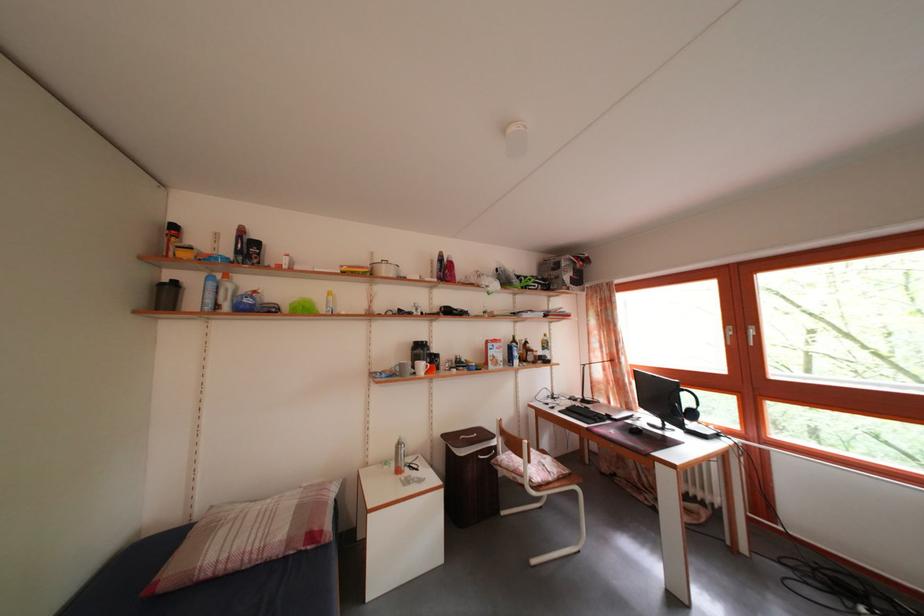
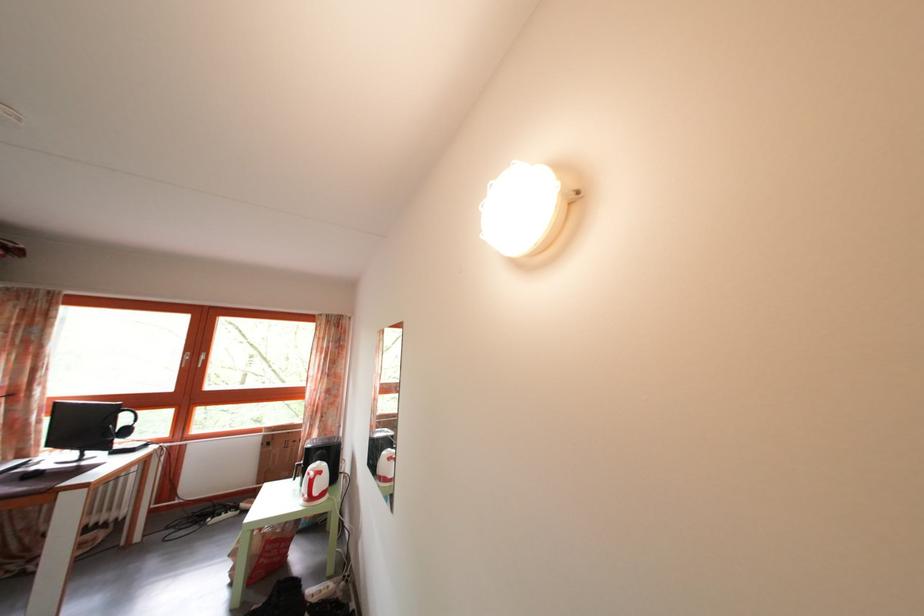
Locate, in the second image, the point that corresponds to [698,432] in the first image.

(128, 451)